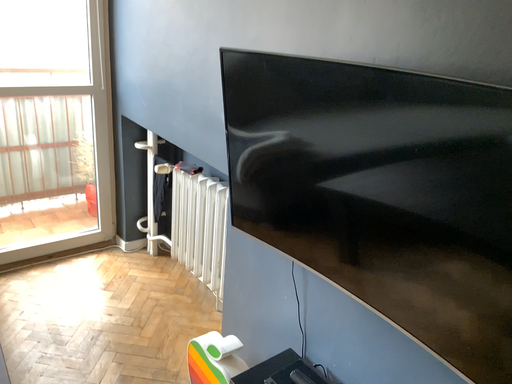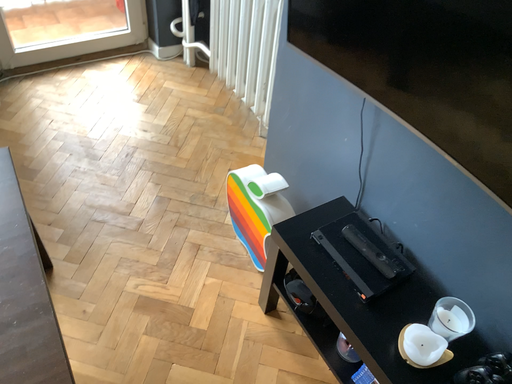
Question: Which way did the camera rotate in the video?

Choices:
 (A) rotated left
 (B) rotated right

Answer: (A)